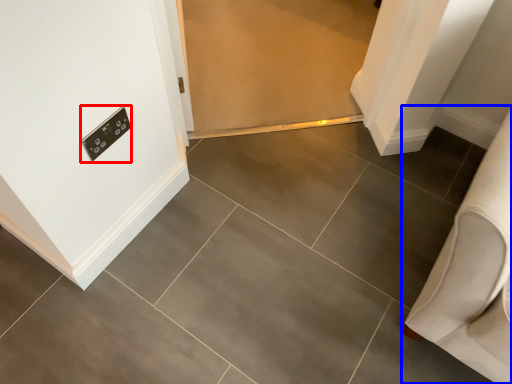
Question: Which of the following is the farthest to the observer, light switch (highlighted by a red box) or furniture (highlighted by a blue box)?

Choices:
 (A) light switch
 (B) furniture

Answer: (A)